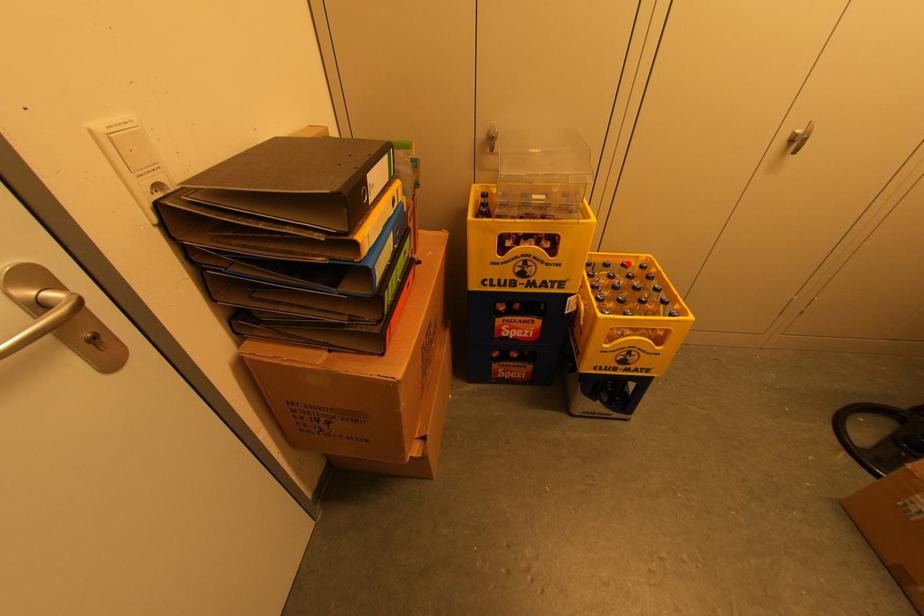
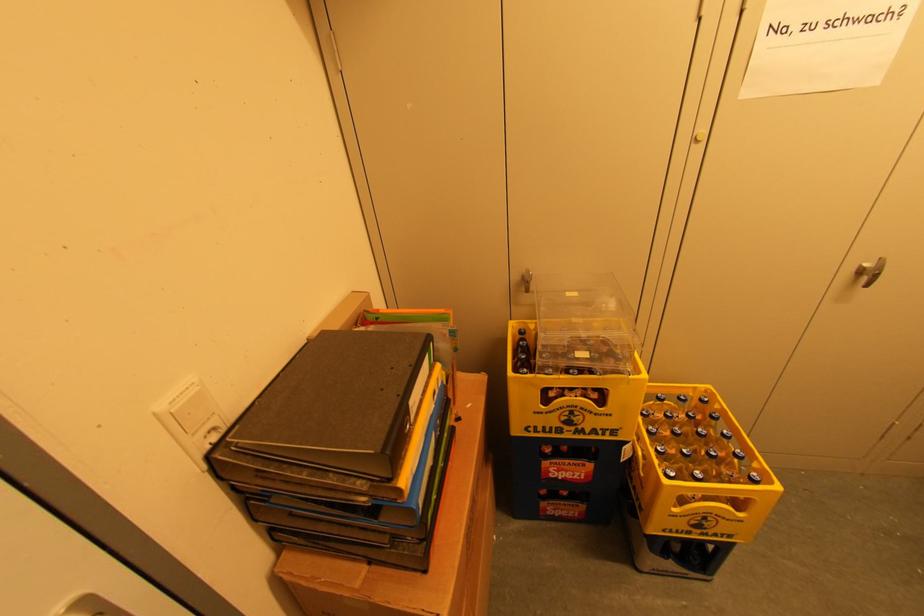
Question: I am providing you with two images of the same scene from different viewpoints. A red point is marked on the first image. At the location where the point appears in image 1, is it still visible in image 2?

Choices:
 (A) Yes
 (B) No

Answer: (A)